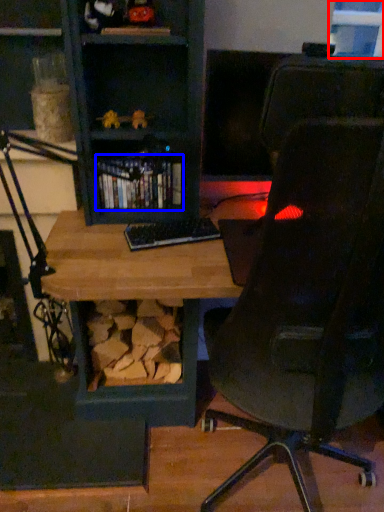
Question: Which of the following is the farthest to the observer, window (highlighted by a red box) or book (highlighted by a blue box)?

Choices:
 (A) window
 (B) book

Answer: (A)